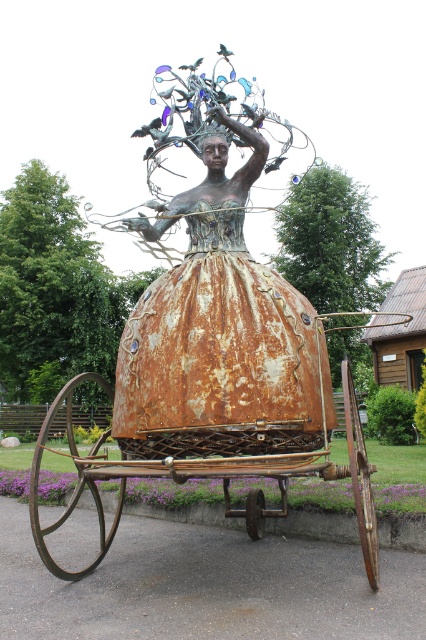
Question: Among these objects, which one is farthest from the camera?

Choices:
 (A) rusty metal sculpture at center
 (B) rusty metal wagon at center

Answer: (A)

Question: Which object appears farthest from the camera in this image?

Choices:
 (A) rusty metal sculpture at center
 (B) rusty metal wagon at center

Answer: (A)

Question: Which object appears farthest from the camera in this image?

Choices:
 (A) rusty metal sculpture at center
 (B) rusty metal wagon at center

Answer: (A)

Question: Does rusty metal sculpture at center appear under rusty metal wagon at center?

Choices:
 (A) no
 (B) yes

Answer: (A)

Question: Can you confirm if rusty metal sculpture at center is bigger than rusty metal wagon at center?

Choices:
 (A) yes
 (B) no

Answer: (B)

Question: Is rusty metal sculpture at center below rusty metal wagon at center?

Choices:
 (A) no
 (B) yes

Answer: (A)